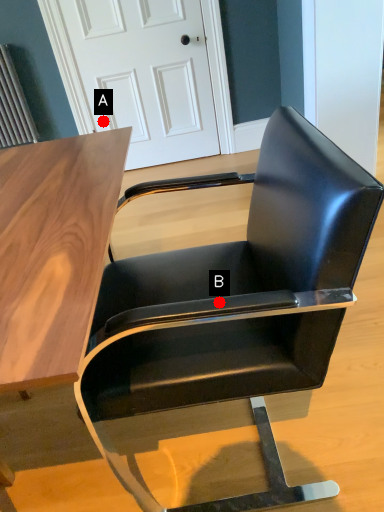
Question: Two points are circled on the image, labeled by A and B beside each circle. Which point is farther to the camera?

Choices:
 (A) A is further
 (B) B is further

Answer: (A)